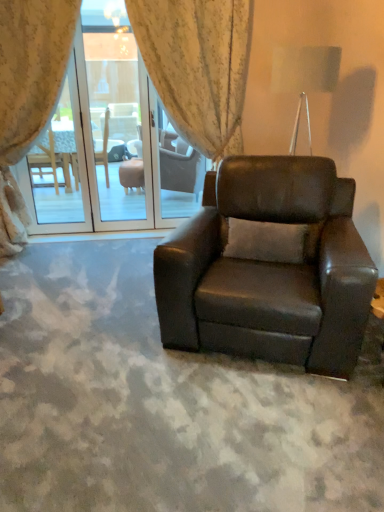
Question: From the image's perspective, is floral fabric curtain at upper left, which appears as the second curtain when viewed from the right, under transparent glass screen door at center?

Choices:
 (A) no
 (B) yes

Answer: (B)

Question: Is floral fabric curtain at upper left, which appears as the second curtain when viewed from the right, not inside transparent glass screen door at center?

Choices:
 (A) no
 (B) yes

Answer: (B)

Question: Is floral fabric curtain at upper left, which appears as the second curtain when viewed from the right, next to transparent glass screen door at center and touching it?

Choices:
 (A) yes
 (B) no

Answer: (B)

Question: Is floral fabric curtain at upper left, which ranks as the 1th curtain in left-to-right order, wider than transparent glass screen door at center?

Choices:
 (A) yes
 (B) no

Answer: (A)

Question: Can you confirm if floral fabric curtain at upper left, which appears as the second curtain when viewed from the right, is shorter than transparent glass screen door at center?

Choices:
 (A) yes
 (B) no

Answer: (A)

Question: Is floral fabric curtain at center, the second curtain viewed from the left, bigger or smaller than floral fabric curtain at upper left, which appears as the second curtain when viewed from the right?

Choices:
 (A) small
 (B) big

Answer: (A)

Question: Is point (203, 10) closer or farther from the camera than point (26, 8)?

Choices:
 (A) farther
 (B) closer

Answer: (A)

Question: Is floral fabric curtain at center, which is the first curtain in right-to-left order, in front of or behind floral fabric curtain at upper left, which ranks as the 1th curtain in left-to-right order, in the image?

Choices:
 (A) front
 (B) behind

Answer: (B)

Question: Visually, is floral fabric curtain at center, which is the first curtain in right-to-left order, positioned to the left or to the right of floral fabric curtain at upper left, which appears as the second curtain when viewed from the right?

Choices:
 (A) left
 (B) right

Answer: (B)

Question: Considering the relative positions of floral fabric curtain at upper left, which ranks as the 1th curtain in left-to-right order, and floral fabric curtain at center, the second curtain viewed from the left, in the image provided, is floral fabric curtain at upper left, which ranks as the 1th curtain in left-to-right order, to the left or to the right of floral fabric curtain at center, the second curtain viewed from the left,?

Choices:
 (A) right
 (B) left

Answer: (B)

Question: Is point (52, 41) positioned closer to the camera than point (240, 137)?

Choices:
 (A) farther
 (B) closer

Answer: (B)

Question: Considering their positions, is floral fabric curtain at upper left, which appears as the second curtain when viewed from the right, located in front of or behind floral fabric curtain at center, the second curtain viewed from the left?

Choices:
 (A) front
 (B) behind

Answer: (A)

Question: From the image's perspective, is floral fabric curtain at upper left, which ranks as the 1th curtain in left-to-right order, positioned above or below floral fabric curtain at center, the second curtain viewed from the left?

Choices:
 (A) above
 (B) below

Answer: (B)

Question: In terms of width, does transparent glass screen door at center look wider or thinner when compared to matte black armchair at center?

Choices:
 (A) wide
 (B) thin

Answer: (B)

Question: From a real-world perspective, is transparent glass screen door at center positioned above or below matte black armchair at center?

Choices:
 (A) above
 (B) below

Answer: (A)